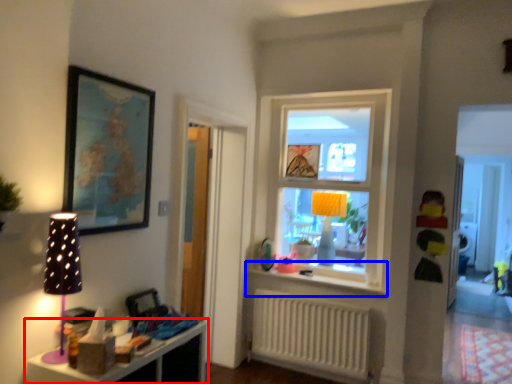
Question: Which point is further to the camera, shelf (highlighted by a red box) or window sill (highlighted by a blue box)?

Choices:
 (A) shelf
 (B) window sill

Answer: (B)